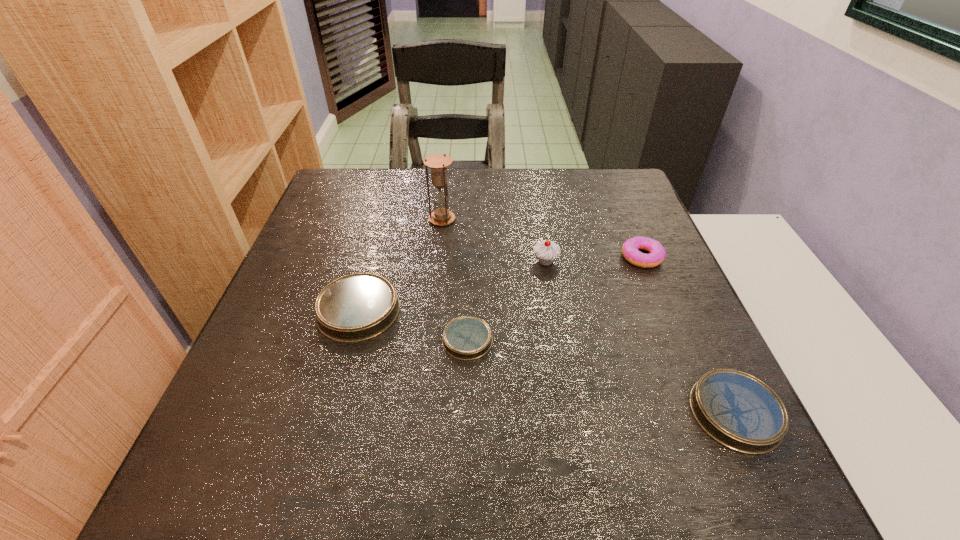
I want to click on the second closest compass to the shortest object, so pyautogui.click(x=737, y=410).

The width and height of the screenshot is (960, 540). I want to click on free space that satisfies the following two spatial constraints: 1. on the front side of the shortest object; 2. on the right side of the nearest compass, so pos(466,413).

Locate an element on the screen. The width and height of the screenshot is (960, 540). free space that satisfies the following two spatial constraints: 1. on the back side of the third object from right to left; 2. on the right side of the leftmost object is located at coordinates (372, 261).

Where is `vacant area that satisfies the following two spatial constraints: 1. on the front side of the doughnut; 2. on the left side of the nearest compass`? This screenshot has height=540, width=960. vacant area that satisfies the following two spatial constraints: 1. on the front side of the doughnut; 2. on the left side of the nearest compass is located at coordinates (707, 413).